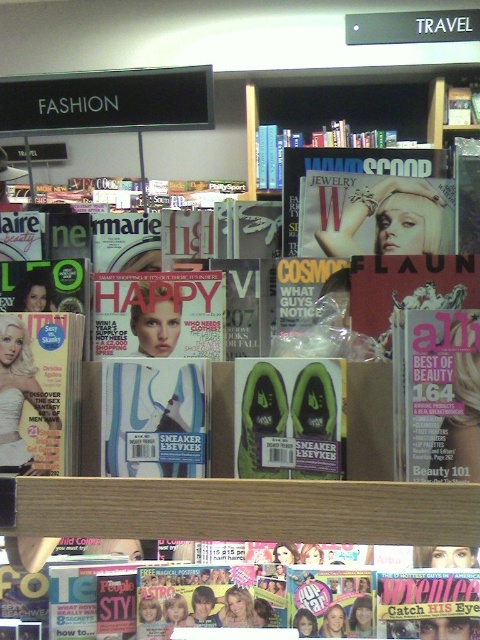
You are a customer at the bookstore and want to pick up both the matte glossy cover at center and the matte pink cover at center. How far apart are these two magazine covers?

The matte glossy cover at center is 13.17 inches from the matte pink cover at center.